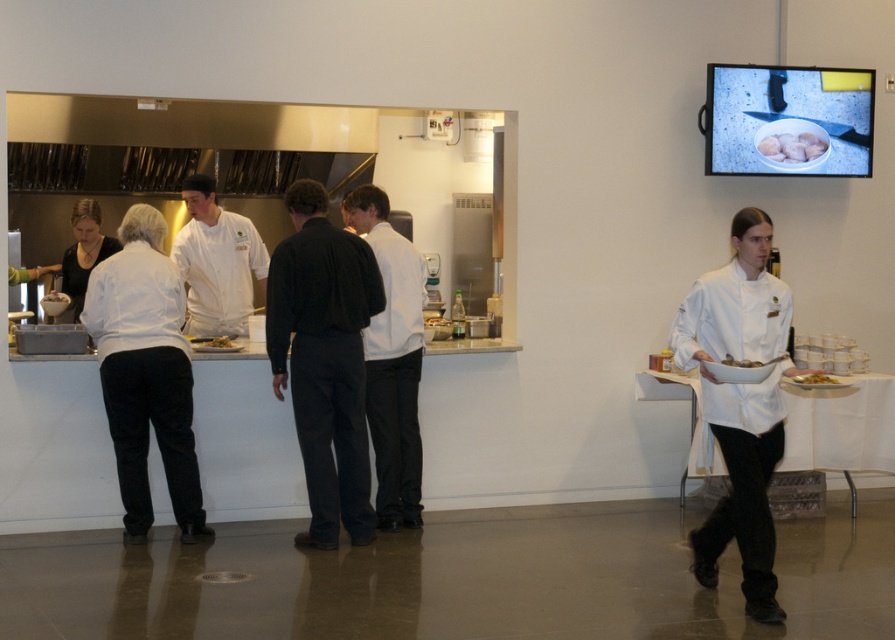
You are a chef in the kitchen and need to place a garnish on the white glossy bowl at right. Which direction should you move to reach it from the green leafy salad at right?

The green leafy salad at right is to the right of the white glossy bowl at right, so you should move to the left to reach the white glossy bowl at right from the green leafy salad at right.

You are a delivery person standing at the entrance of the kitchen. You need to hand over a package to the person wearing the black cotton shirt at center. According to the layout, where should you go to find them?

The black cotton shirt at center is located at point (324, 360), so you should go to the center area of the kitchen to find them.

You are a customer waiting at a table in the restaurant. You see a black cotton shirt at center and a white glossy bowl at right. Which object is larger?

The black cotton shirt at center is bigger than the white glossy bowl at right.